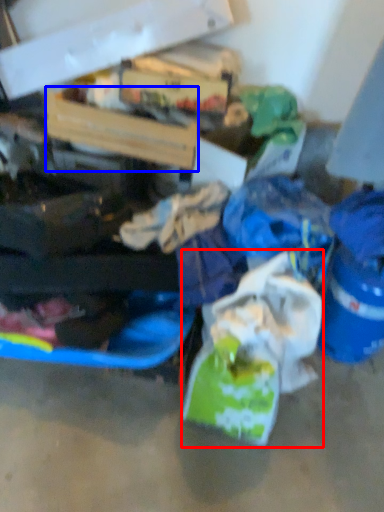
Question: Which object appears farthest to the camera in this image, plastic bag (highlighted by a red box) or box (highlighted by a blue box)?

Choices:
 (A) plastic bag
 (B) box

Answer: (B)